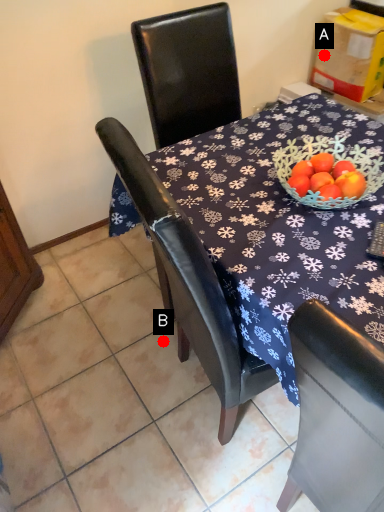
Question: Two points are circled on the image, labeled by A and B beside each circle. Which point is further to the camera?

Choices:
 (A) A is further
 (B) B is further

Answer: (A)